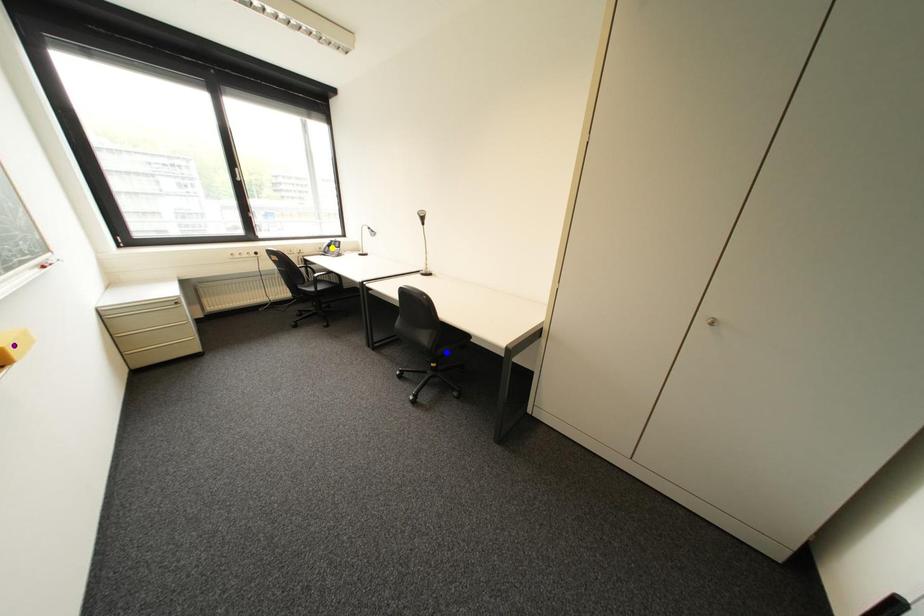
Order these from nearest to farthest:
purple point
yellow point
blue point

1. purple point
2. blue point
3. yellow point